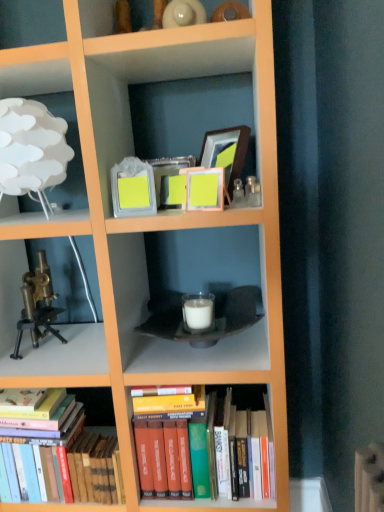
Question: Is wooden picture frame at upper center, arranged as the third picture frame when viewed from the left, situated inside matte yellow picture frame at center, the 2th picture frame from the right, or outside?

Choices:
 (A) inside
 (B) outside

Answer: (B)

Question: In the image, is wooden picture frame at upper center, which appears as the third picture frame when viewed from the front, on the left side or the right side of matte yellow picture frame at center, arranged as the third picture frame when viewed from the back?

Choices:
 (A) left
 (B) right

Answer: (B)

Question: Which object is positioned closest to the brass metallic microscope at left?

Choices:
 (A) matte yellow picture frame at center, the second picture frame from the left
 (B) matte glass picture frame at upper center, which ranks as the first picture frame in left-to-right order
 (C) wooden picture frame at upper center, which appears as the 1th picture frame when viewed from the back
 (D) hardcover books at lower left, acting as the first book starting from the left
 (E) white paper lampshade at upper left

Answer: (D)

Question: Considering the real-world distances, which object is closest to the matte glass picture frame at upper center, the third picture frame when ordered from right to left?

Choices:
 (A) matte yellow picture frame at center, positioned as the 1th picture frame in front-to-back order
 (B) wooden picture frame at upper center, arranged as the third picture frame when viewed from the left
 (C) hardcover books at lower left, acting as the first book starting from the left
 (D) brass metallic microscope at left
 (E) hardcover books at center, the first book viewed from the right

Answer: (A)